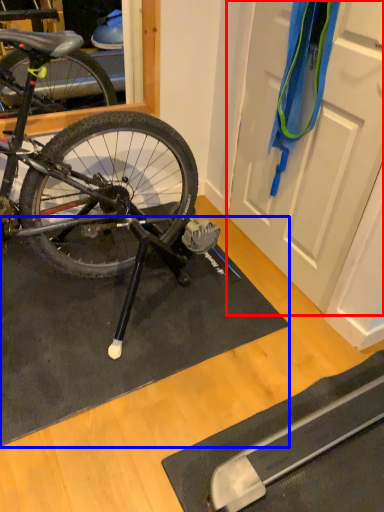
Question: Which of the following is the farthest to the observer, door (highlighted by a red box) or doormat (highlighted by a blue box)?

Choices:
 (A) door
 (B) doormat

Answer: (B)